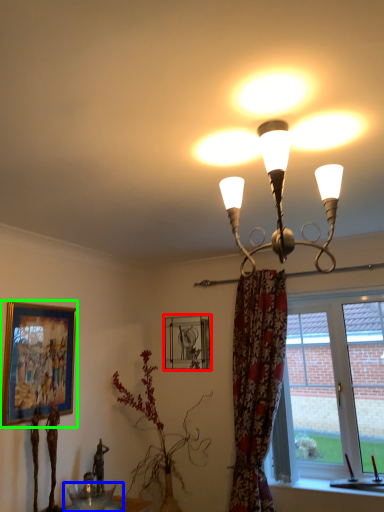
Question: Which object is the farthest from picture frame (highlighted by a red box)? Choose among these: glass table (highlighted by a blue box) or picture frame (highlighted by a green box).

Choices:
 (A) glass table
 (B) picture frame

Answer: (A)